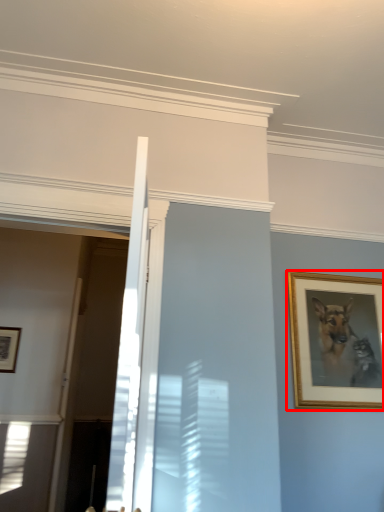
Question: Where is picture frame (annotated by the red box) located in relation to picture frame in the image?

Choices:
 (A) left
 (B) right

Answer: (B)